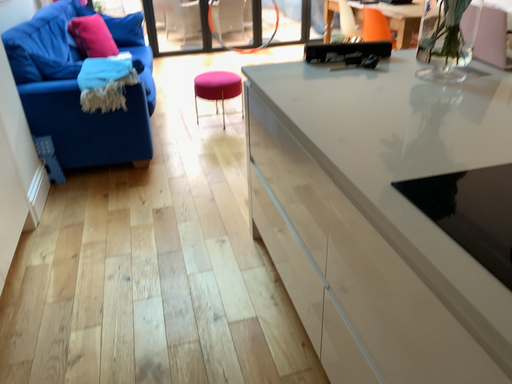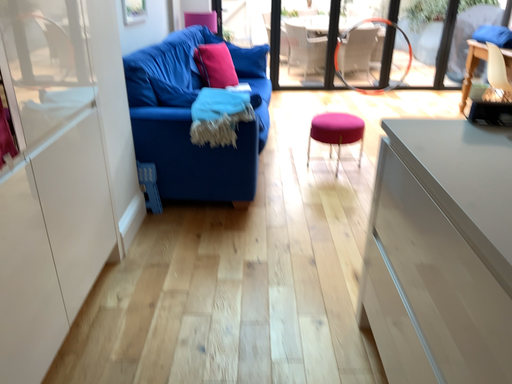
Question: How did the camera likely rotate when shooting the video?

Choices:
 (A) rotated left
 (B) rotated right

Answer: (A)